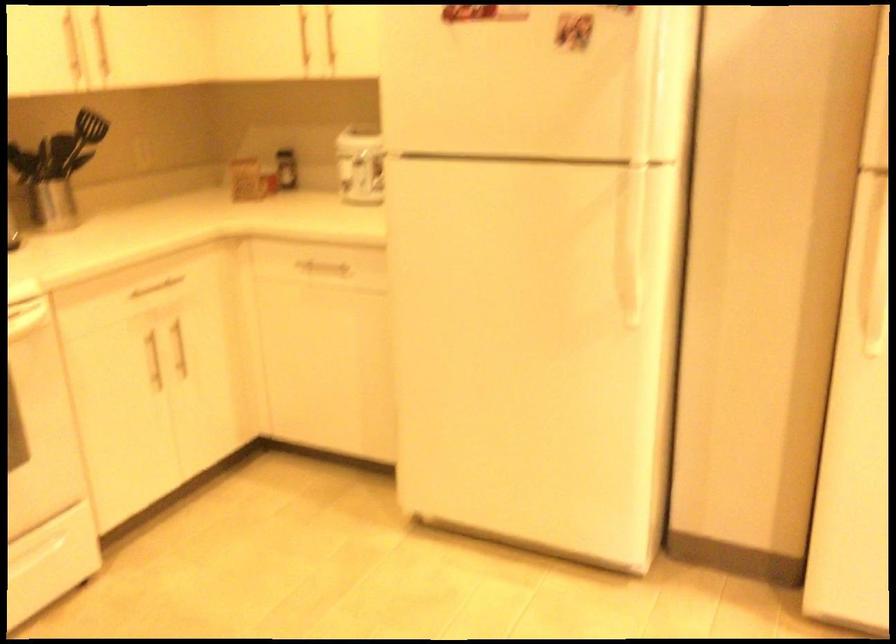
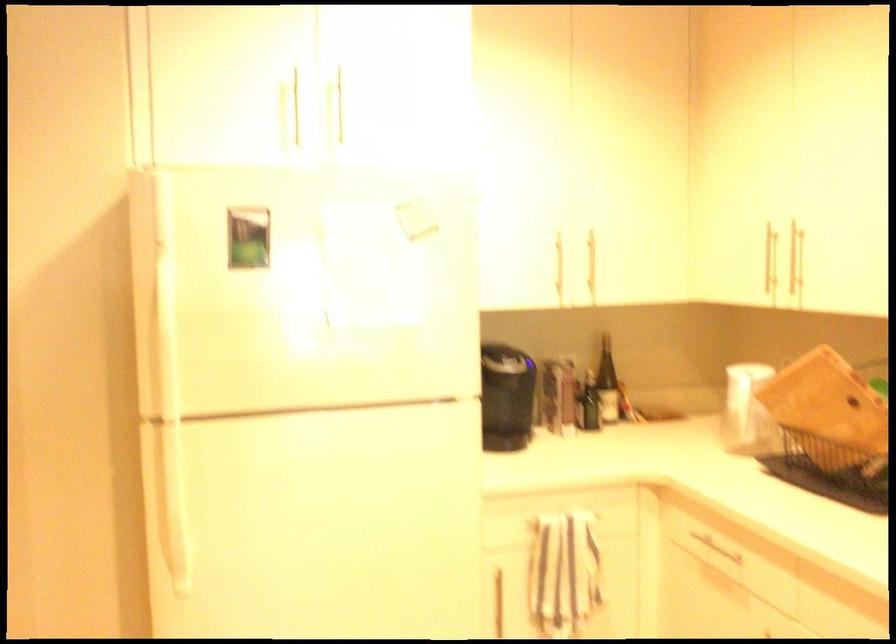
Question: The camera is either moving clockwise (left) or counter-clockwise (right) around the object. The first image is from the beginning of the video and the second image is from the end. Is the camera moving left or right when shooting the video?

Choices:
 (A) Left
 (B) Right

Answer: (A)